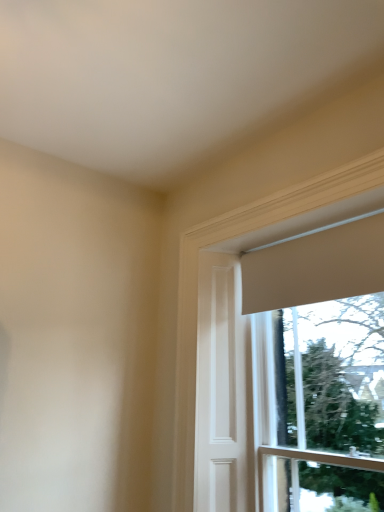
This screenshot has height=512, width=384. What do you see at coordinates (197, 286) in the screenshot?
I see `matte white window at upper right` at bounding box center [197, 286].

Identify the location of matte white window at upper right. This screenshot has height=512, width=384. (197, 286).

What is the approximate height of matte white window at upper right?

matte white window at upper right is 5.01 feet in height.

Where is `matte white window at upper right`? matte white window at upper right is located at coordinates (197, 286).